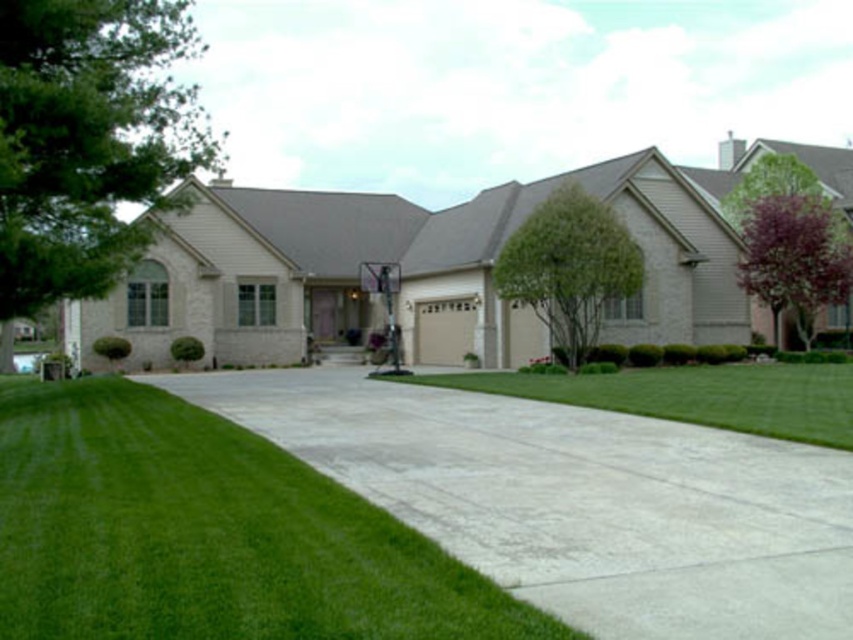
Question: Which of the following is the farthest from the observer?

Choices:
 (A) (833, 272)
 (B) (572, 339)

Answer: (A)

Question: Can you confirm if green leafy tree at upper left is wider than purple leafy tree at right?

Choices:
 (A) no
 (B) yes

Answer: (B)

Question: Is concrete at center positioned at the back of green leafy tree at center?

Choices:
 (A) no
 (B) yes

Answer: (A)

Question: Which object appears closest to the camera in this image?

Choices:
 (A) green leafy tree at upper left
 (B) green grass at center
 (C) purple leafy tree at right
 (D) green leafy tree at center

Answer: (B)

Question: Which of these objects is positioned closest to the green grass at center?

Choices:
 (A) purple leafy tree at right
 (B) green leafy tree at center

Answer: (A)

Question: Is green grass at center positioned in front of purple leafy tree at right?

Choices:
 (A) no
 (B) yes

Answer: (B)